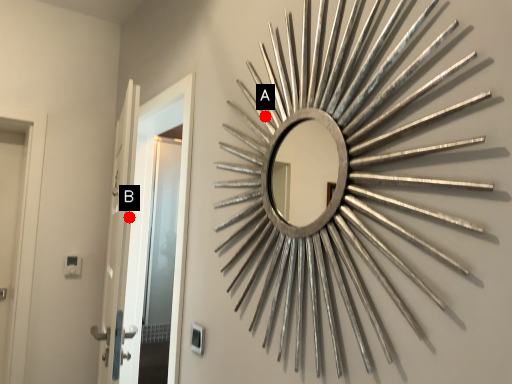
Question: Two points are circled on the image, labeled by A and B beside each circle. Which point appears closest to the camera in this image?

Choices:
 (A) A is closer
 (B) B is closer

Answer: (A)